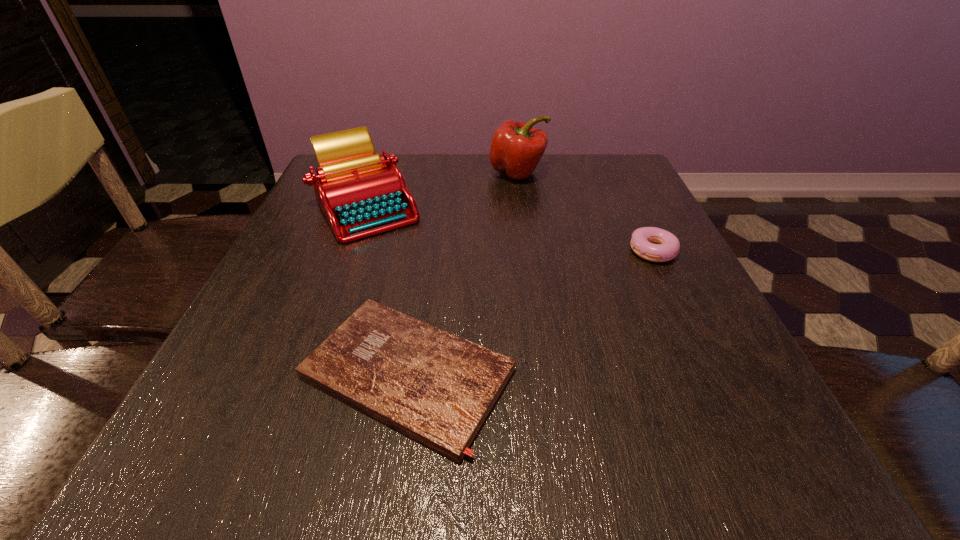
Find the location of `free spot between the typewriter and the rightmost object`. free spot between the typewriter and the rightmost object is located at coordinates (510, 229).

At what (x,y) coordinates should I click in order to perform the action: click on empty space between the typewriter and the doughnut. Please return your answer as a coordinate pair (x, y). The height and width of the screenshot is (540, 960). Looking at the image, I should click on (510, 229).

You are a GUI agent. You are given a task and a screenshot of the screen. Output one action in this format:
    pyautogui.click(x=<x>, y=<y>)
    Task: Click on the vacant space that is in between the pepper and the shortest object
    The image size is (960, 540).
    Given the screenshot: What is the action you would take?
    [x=463, y=273]

Image resolution: width=960 pixels, height=540 pixels. In order to click on object that stands as the third closest to the shortest object in this screenshot , I will do `click(516, 148)`.

Point out which object is positioned as the nearest to the pepper. Please provide its 2D coordinates. Your answer should be formatted as a tuple, i.e. [(x, y)], where the tuple contains the x and y coordinates of a point satisfying the conditions above.

[(360, 193)]

Locate an element on the screen. The width and height of the screenshot is (960, 540). free point that satisfies the following two spatial constraints: 1. on the typing side of the typewriter; 2. on the right side of the doughnut is located at coordinates (349, 252).

Where is `free space that satisfies the following two spatial constraints: 1. on the typing side of the doughnut; 2. on the left side of the typewriter`? free space that satisfies the following two spatial constraints: 1. on the typing side of the doughnut; 2. on the left side of the typewriter is located at coordinates (349, 252).

I want to click on free space that satisfies the following two spatial constraints: 1. on the typing side of the typewriter; 2. on the left side of the nearest object, so click(305, 374).

Identify the location of vacant space that satisfies the following two spatial constraints: 1. on the typing side of the typewriter; 2. on the right side of the doughnut. (349, 252).

Locate an element on the screen. Image resolution: width=960 pixels, height=540 pixels. vacant position in the image that satisfies the following two spatial constraints: 1. on the typing side of the typewriter; 2. on the right side of the nearest object is located at coordinates (305, 374).